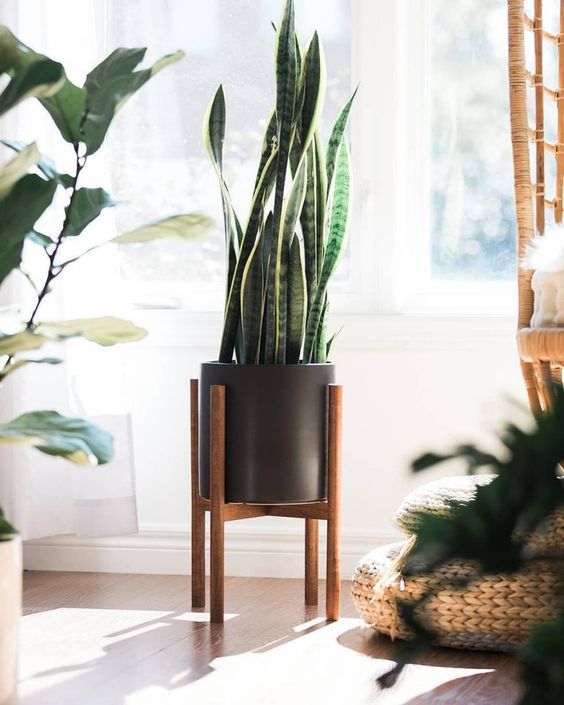
The height and width of the screenshot is (705, 564). I want to click on 1 partial seat cushion, so click(x=549, y=295).